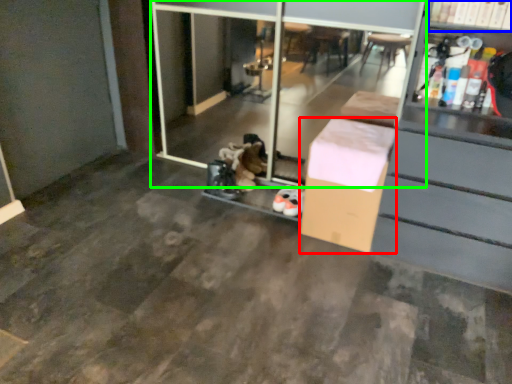
Question: Which object is the farthest from box (highlighted by a red box)? Choose among these: shelf (highlighted by a blue box) or screen door (highlighted by a green box).

Choices:
 (A) shelf
 (B) screen door

Answer: (B)